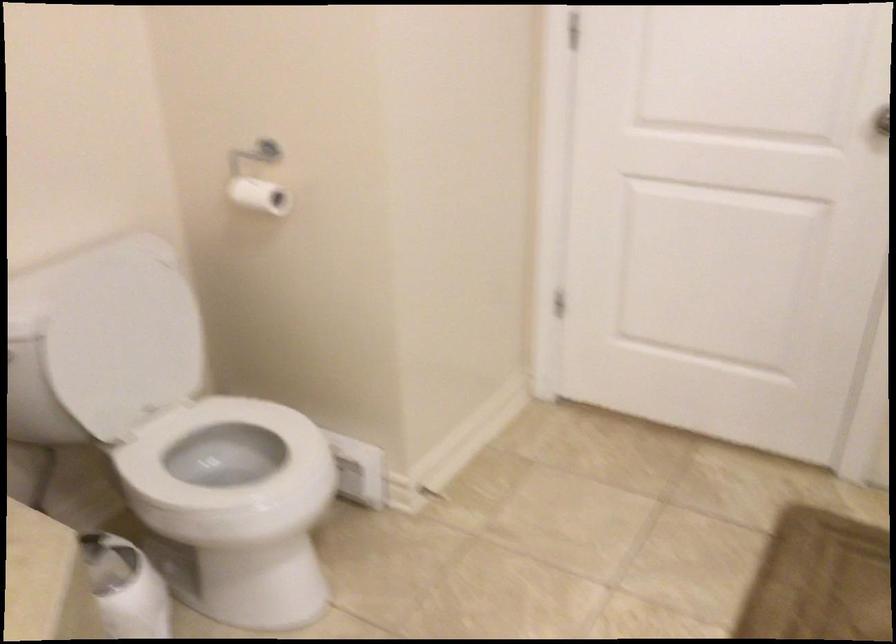
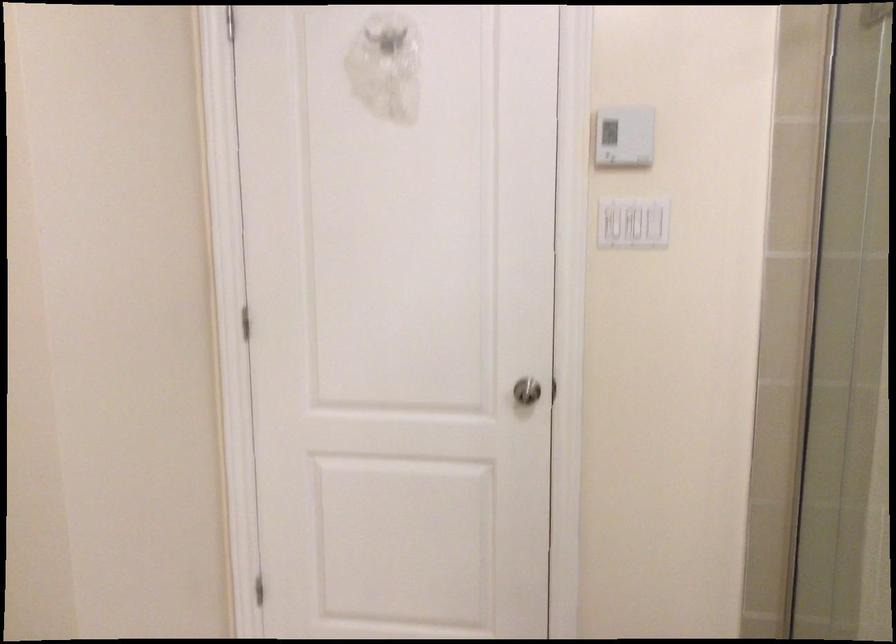
First-person continuous shooting, in which direction is the camera rotating?

The rotation direction of the camera is right-up.